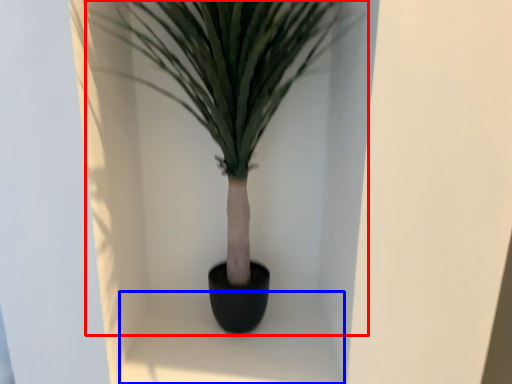
Question: Which object appears farthest to the camera in this image, houseplant (highlighted by a red box) or window sill (highlighted by a blue box)?

Choices:
 (A) houseplant
 (B) window sill

Answer: (B)